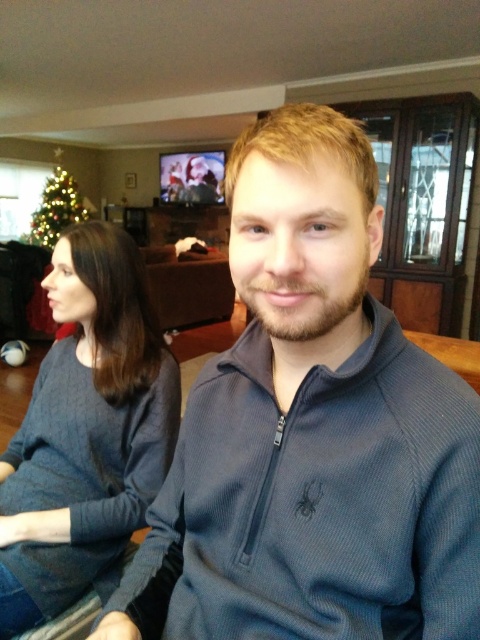
Does dark gray sweater at left come behind green matte christmas tree at left?

No, dark gray sweater at left is in front of green matte christmas tree at left.

Find the location of a particular element. dark gray sweater at left is located at coordinates (85, 432).

The width and height of the screenshot is (480, 640). I want to click on dark gray sweater at left, so click(x=85, y=432).

In the scene shown: Is dark blue zip-up sweater at center closer to camera compared to green matte christmas tree at left?

Yes, dark blue zip-up sweater at center is in front of green matte christmas tree at left.

Is dark blue zip-up sweater at center smaller than green matte christmas tree at left?

Correct, dark blue zip-up sweater at center occupies less space than green matte christmas tree at left.

At what (x,y) coordinates should I click in order to perform the action: click on dark blue zip-up sweater at center. Please return your answer as a coordinate pair (x, y). The width and height of the screenshot is (480, 640). Looking at the image, I should click on (312, 432).

This screenshot has width=480, height=640. What are the coordinates of `dark blue zip-up sweater at center` in the screenshot? It's located at click(312, 432).

Who is more distant from viewer, (236, 566) or (122, 461)?

The point (122, 461) is behind.

Can you confirm if dark blue zip-up sweater at center is smaller than dark gray sweater at left?

Correct, dark blue zip-up sweater at center occupies less space than dark gray sweater at left.

Is point (429, 419) closer to viewer compared to point (60, 272)?

Yes, point (429, 419) is closer to viewer.

Locate an element on the screen. This screenshot has width=480, height=640. dark blue zip-up sweater at center is located at coordinates (312, 432).